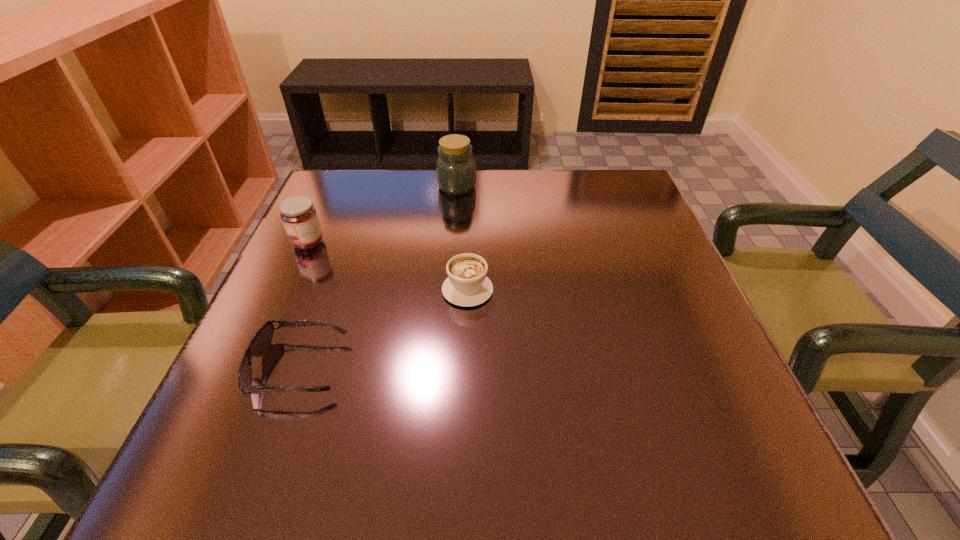
I want to click on free area in between the third nearest object and the third farthest object, so click(388, 266).

At what (x,y) coordinates should I click in order to perform the action: click on unoccupied position between the second tallest object and the nearest object. Please return your answer as a coordinate pair (x, y). This screenshot has width=960, height=540. Looking at the image, I should click on pos(303,305).

Image resolution: width=960 pixels, height=540 pixels. What are the coordinates of `object that stands as the second closest to the jam` in the screenshot? It's located at (467, 285).

Locate which object ranks third in proximity to the farthest object. Please provide its 2D coordinates. Your answer should be formatted as a tuple, i.e. [(x, y)], where the tuple contains the x and y coordinates of a point satisfying the conditions above.

[(262, 339)]

The image size is (960, 540). Find the location of `vacant space that satisfies the following two spatial constraints: 1. on the front side of the jar; 2. on the front-facing side of the sunglasses`. vacant space that satisfies the following two spatial constraints: 1. on the front side of the jar; 2. on the front-facing side of the sunglasses is located at coordinates (444, 367).